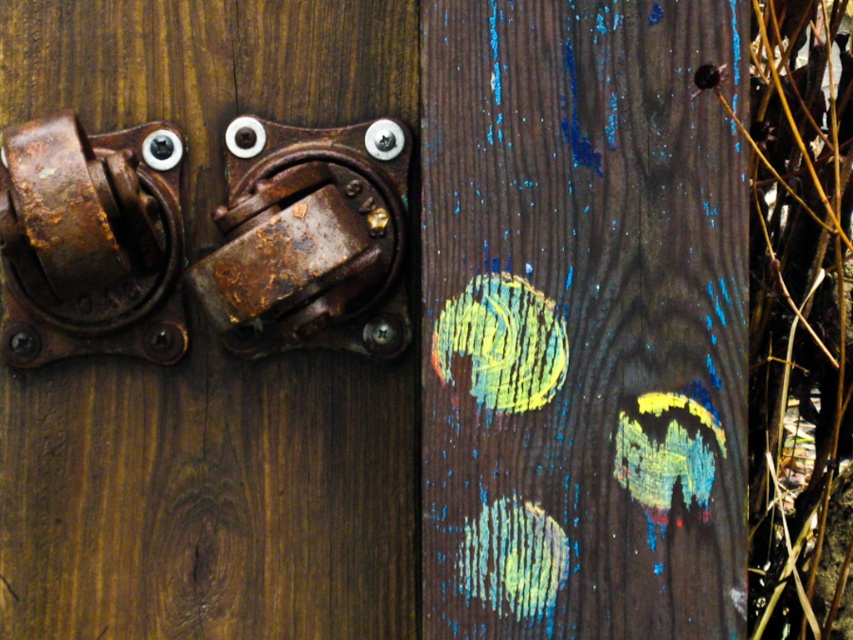
You are standing in front of a wooden surface with a rusty metal latch on the left and colorful splashes on the right. There is a point at coordinates point (492, 396). If you want to touch this point with a 3.5 feet long stick, will you be able to reach it?

The distance between point (492, 396) and the camera is 3.65 feet. Since the stick is 3.5 feet long, which is shorter than the distance, you cannot reach the point with the stick.

You are a painter standing in front of the wooden surface. You want to paint the rusty metal door handle at center. However, there is a wooden plank with paint splatters at center blocking your view. Can you paint the door handle without moving the plank?

The rusty metal door handle at center is behind the wooden plank with paint splatters at center, so you cannot paint the door handle without moving the plank because it is obstructed by the plank.

You are a painter who wants to paint the wooden surface. You notice two rusty metal door handles on the wooden surface. Which one is closer to you, the rusty metal door handle at center or the rusty metal door handle at left?

The rusty metal door handle at left is behind the rusty metal door handle at center, so the rusty metal door handle at center is closer to you.